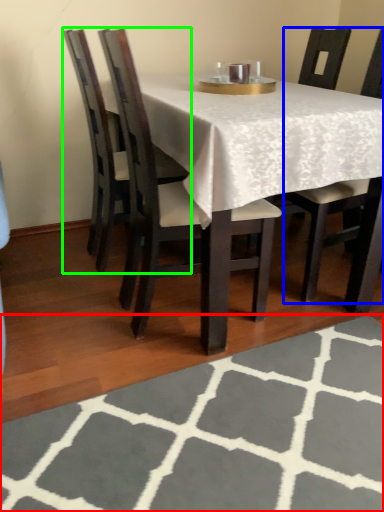
Question: Estimate the real-world distances between objects in this image. Which object is closer to place mat (highlighted by a red box), chair (highlighted by a blue box) or chair (highlighted by a green box)?

Choices:
 (A) chair
 (B) chair

Answer: (A)